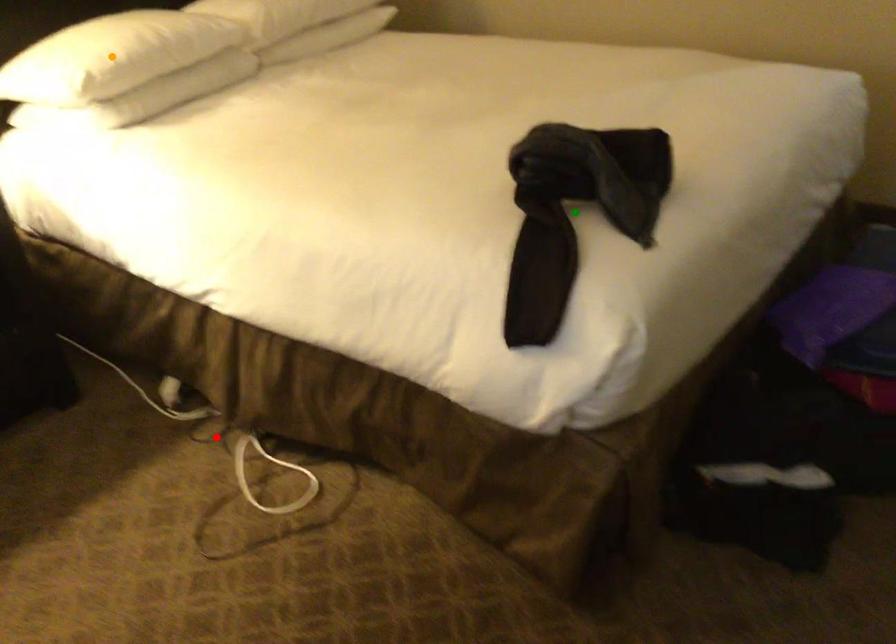
Order these from nearest to farthest:
A) red point
B) green point
C) orange point

orange point
red point
green point